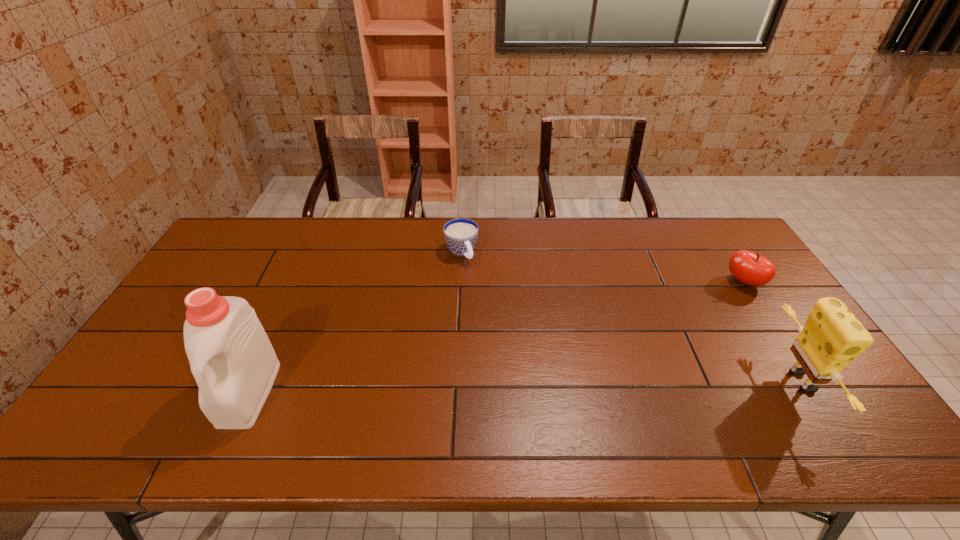
Locate an element on the screen. Image resolution: width=960 pixels, height=540 pixels. vacant area that lies between the apple and the detergent is located at coordinates (496, 338).

At what (x,y) coordinates should I click in order to perform the action: click on unoccupied position between the apple and the sponge. Please return your answer as a coordinate pair (x, y). Looking at the image, I should click on (773, 332).

The image size is (960, 540). What are the coordinates of `unoccupied position between the sponge and the apple` in the screenshot? It's located at (773, 332).

I want to click on empty space between the shortest object and the detergent, so click(x=355, y=322).

Locate an element on the screen. This screenshot has height=540, width=960. object that is the third closest to the shortest object is located at coordinates (832, 337).

Locate an element on the screen. The image size is (960, 540). the closest object relative to the apple is located at coordinates (832, 337).

Identify the location of free space that satisfies the following two spatial constraints: 1. on the front side of the second shortest object; 2. on the left side of the farthest object. The width and height of the screenshot is (960, 540). (460, 282).